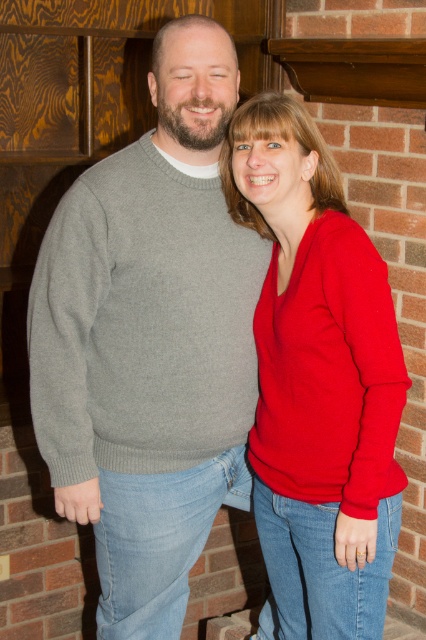
You are an interior designer analyzing the placement of clothing items in the scene. Given that the gray sweater at center is positioned at coordinates 0.533 on the x and 0.352 on the y axis, can you determine if it is centrally located in the image?

The gray sweater at center is located at point (149,340), which means it is positioned slightly to the right and lower than the exact center of the image. Therefore, it is not perfectly centrally located.